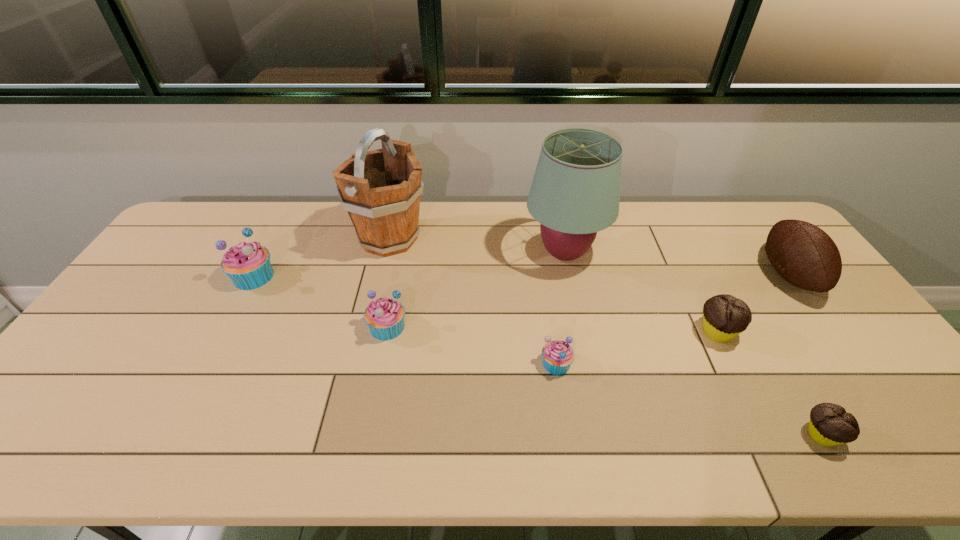
In the image, there is a desktop. Where is `vacant area at the left edge`? vacant area at the left edge is located at coordinates (161, 284).

In the image, there is a desktop. In order to click on vacant space at the right edge in this screenshot , I will do `click(902, 388)`.

Identify the location of free region at the far left corner of the desktop. (203, 206).

Find the location of a particular element. free space at the near left corner of the desktop is located at coordinates (87, 429).

What are the coordinates of `free space at the near right corner` in the screenshot? It's located at (916, 458).

What are the coordinates of `free point between the second smallest blue muffin and the fourth muffin from left to right` in the screenshot? It's located at (552, 329).

In order to click on free area in between the tallest muffin and the smaller chocolate muffin in this screenshot , I will do `click(538, 356)`.

At what (x,y) coordinates should I click in order to perform the action: click on vacant region between the farthest muffin and the second biggest blue muffin. Please return your answer as a coordinate pair (x, y). Looking at the image, I should click on pos(321,302).

The width and height of the screenshot is (960, 540). In order to click on blank region between the bucket and the blue lampshade in this screenshot , I will do `click(477, 246)`.

Where is `vacant area that lies between the rightmost blue muffin and the second farthest blue muffin`? The width and height of the screenshot is (960, 540). vacant area that lies between the rightmost blue muffin and the second farthest blue muffin is located at coordinates (471, 345).